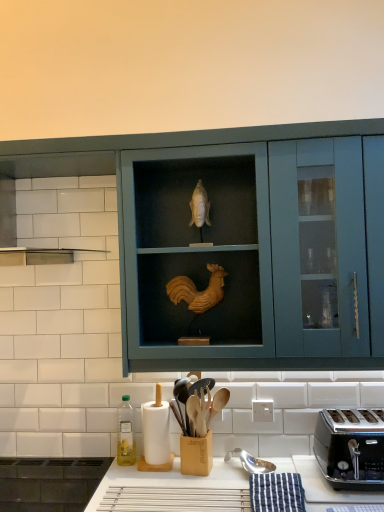
I want to click on teal matte cabinet at center, so click(x=125, y=200).

How different are the orientations of teal matte cabinet at center and black metallic toaster at lower right in degrees?

4.86 degrees separate the facing orientations of teal matte cabinet at center and black metallic toaster at lower right.

Is teal matte cabinet at center directly adjacent to black metallic toaster at lower right?

No, teal matte cabinet at center is not next to black metallic toaster at lower right.

Does teal matte cabinet at center come behind black metallic toaster at lower right?

No.

From the image's perspective, relative to black metallic toaster at lower right, is green glass bottle at lower left above or below?

green glass bottle at lower left is below black metallic toaster at lower right.

How many degrees apart are the facing directions of green glass bottle at lower left and black metallic toaster at lower right?

2.67 degrees.

Visually, is green glass bottle at lower left positioned to the left or to the right of black metallic toaster at lower right?

green glass bottle at lower left is to the left of black metallic toaster at lower right.

How distant is green glass bottle at lower left from black metallic toaster at lower right?

green glass bottle at lower left is 32.33 inches from black metallic toaster at lower right.

Looking at this image, between green glass bottle at lower left and white matte paper towel at lower left, which one has larger size?

Bigger between the two is white matte paper towel at lower left.

Between green glass bottle at lower left and white matte paper towel at lower left, which one has smaller width?

green glass bottle at lower left is thinner.

What's the angular difference between green glass bottle at lower left and white matte paper towel at lower left's facing directions?

The facing directions of green glass bottle at lower left and white matte paper towel at lower left are 0.00397 degrees apart.

Which object is positioned more to the right, green glass bottle at lower left or white matte paper towel at lower left?

Positioned to the right is white matte paper towel at lower left.

From a real-world perspective, who is located higher, black metallic toaster at lower right or teal matte cabinet at center?

teal matte cabinet at center, from a real-world perspective.

Who is taller, black metallic toaster at lower right or teal matte cabinet at center?

With more height is teal matte cabinet at center.

Based on the photo, can you confirm if black metallic toaster at lower right is positioned to the right of teal matte cabinet at center?

Indeed, black metallic toaster at lower right is positioned on the right side of teal matte cabinet at center.

From the image's perspective, which is above, white matte paper towel at lower left or black metallic toaster at lower right?

white matte paper towel at lower left.

Which is correct: white matte paper towel at lower left is inside black metallic toaster at lower right, or outside of it?

white matte paper towel at lower left is not enclosed by black metallic toaster at lower right.

Image resolution: width=384 pixels, height=512 pixels. Identify the location of paper towel lying on the left of black metallic toaster at lower right. (156, 432).

Is white matte paper towel at lower left far from black metallic toaster at lower right?

white matte paper towel at lower left is near black metallic toaster at lower right, not far away.

Is white matte paper towel at lower left directly adjacent to green glass bottle at lower left?

white matte paper towel at lower left and green glass bottle at lower left are clearly separated.

Is green glass bottle at lower left at the back of white matte paper towel at lower left?

white matte paper towel at lower left does not have its back to green glass bottle at lower left.

From the image's perspective, is white matte paper towel at lower left beneath green glass bottle at lower left?

Result: No, from the image's perspective, white matte paper towel at lower left is not beneath green glass bottle at lower left.

Locate an element on the screen. The height and width of the screenshot is (512, 384). cabinetry above the green glass bottle at lower left (from the image's perspective) is located at coordinates (125, 200).

From a real-world perspective, which is physically below, teal matte cabinet at center or green glass bottle at lower left?

green glass bottle at lower left.

Looking at this image, are teal matte cabinet at center and green glass bottle at lower left located far from each other?

teal matte cabinet at center is actually quite close to green glass bottle at lower left.

How much distance is there between teal matte cabinet at center and green glass bottle at lower left?

teal matte cabinet at center and green glass bottle at lower left are 73.99 centimeters apart.

Find the location of a particular element. This screenshot has width=384, height=512. cabinetry that is in front of the black metallic toaster at lower right is located at coordinates 125,200.

Find the location of `bottle that is above the black metallic toaster at lower right (from a real-world perspective)`. bottle that is above the black metallic toaster at lower right (from a real-world perspective) is located at coordinates (125, 434).

When comparing their distances from teal matte cabinet at center, does green glass bottle at lower left or black metallic toaster at lower right seem closer?

black metallic toaster at lower right lies closer to teal matte cabinet at center than the other object.

When comparing their distances from black metallic toaster at lower right, does teal matte cabinet at center or white matte paper towel at lower left seem closer?

teal matte cabinet at center.

Based on their spatial positions, is teal matte cabinet at center or black metallic toaster at lower right closer to green glass bottle at lower left?

teal matte cabinet at center lies closer to green glass bottle at lower left than the other object.

Based on their spatial positions, is white matte paper towel at lower left or black metallic toaster at lower right closer to teal matte cabinet at center?

black metallic toaster at lower right is closer to teal matte cabinet at center.

Estimate the real-world distances between objects in this image. Which object is further from green glass bottle at lower left, white matte paper towel at lower left or teal matte cabinet at center?

teal matte cabinet at center is positioned further to the anchor green glass bottle at lower left.

Considering their positions, is green glass bottle at lower left positioned further to white matte paper towel at lower left than black metallic toaster at lower right?

Among the two, black metallic toaster at lower right is located further to white matte paper towel at lower left.

From the image, which object appears to be farther from green glass bottle at lower left, teal matte cabinet at center or white matte paper towel at lower left?

teal matte cabinet at center is positioned further to the anchor green glass bottle at lower left.

Considering their positions, is green glass bottle at lower left positioned further to black metallic toaster at lower right than teal matte cabinet at center?

Among the two, green glass bottle at lower left is located further to black metallic toaster at lower right.

I want to click on paper towel between teal matte cabinet at center and green glass bottle at lower left in the up-down direction, so click(156, 432).

You are a GUI agent. You are given a task and a screenshot of the screen. Output one action in this format:
    pyautogui.click(x=<x>, y=<y>)
    Task: Click on the cabinetry located between green glass bottle at lower left and black metallic toaster at lower right in the left-right direction
    Image resolution: width=384 pixels, height=512 pixels.
    Given the screenshot: What is the action you would take?
    pyautogui.click(x=125, y=200)

The height and width of the screenshot is (512, 384). In order to click on paper towel between teal matte cabinet at center and black metallic toaster at lower right vertically in this screenshot , I will do `click(156, 432)`.

The width and height of the screenshot is (384, 512). I want to click on paper towel between green glass bottle at lower left and black metallic toaster at lower right from left to right, so click(156, 432).